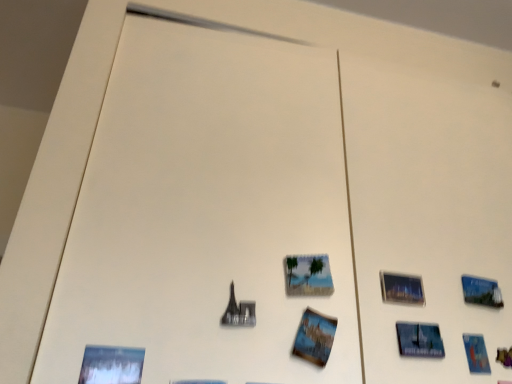
Question: In the image, is matte plastic picture frame at center, which is the first picture frame from left to right, positioned in front of or behind blue glossy postcard at lower right, the 1th postcard from the right?

Choices:
 (A) behind
 (B) front

Answer: (B)

Question: In terms of width, does matte plastic picture frame at center, which is the first picture frame from left to right, look wider or thinner when compared to blue glossy postcard at lower right, placed as the 2th postcard when sorted from left to right?

Choices:
 (A) wide
 (B) thin

Answer: (A)

Question: Which object is the closest to the blue glossy postcard at lower right, placed as the 2th postcard when sorted from left to right?

Choices:
 (A) printed paper postcard at center, which is the second postcard from right to left
 (B) metallic glass picture frame at upper right, arranged as the first picture frame when viewed from the right
 (C) matte plastic picture frame at center, which is the first picture frame from left to right

Answer: (B)

Question: Which object is the closest to the blue glossy postcard at lower right, the 1th postcard positioned from the back?

Choices:
 (A) matte plastic picture frame at center, which is the first picture frame from left to right
 (B) metallic glass picture frame at upper right, marked as the 2th picture frame in a left-to-right arrangement
 (C) printed paper postcard at center, which is the second postcard from back to front

Answer: (B)